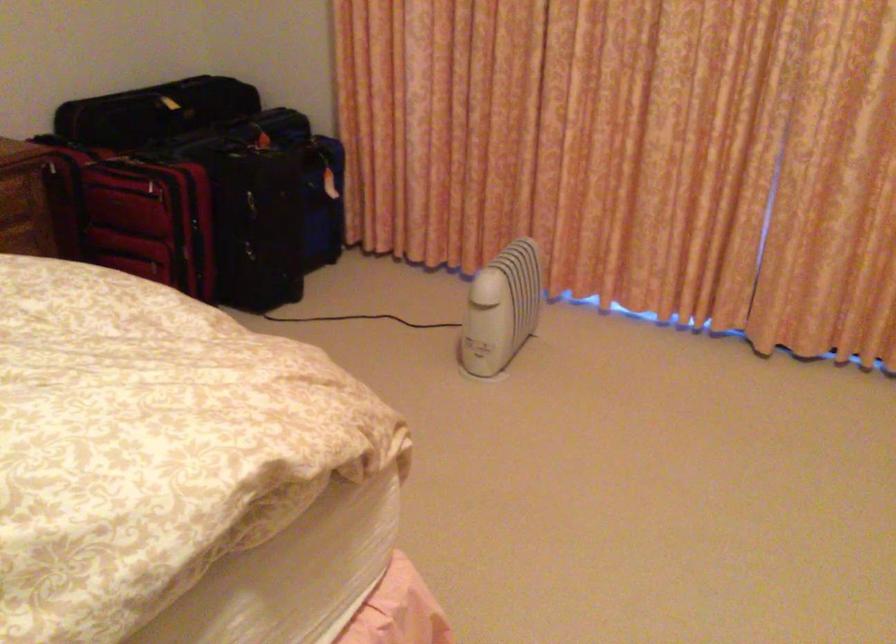
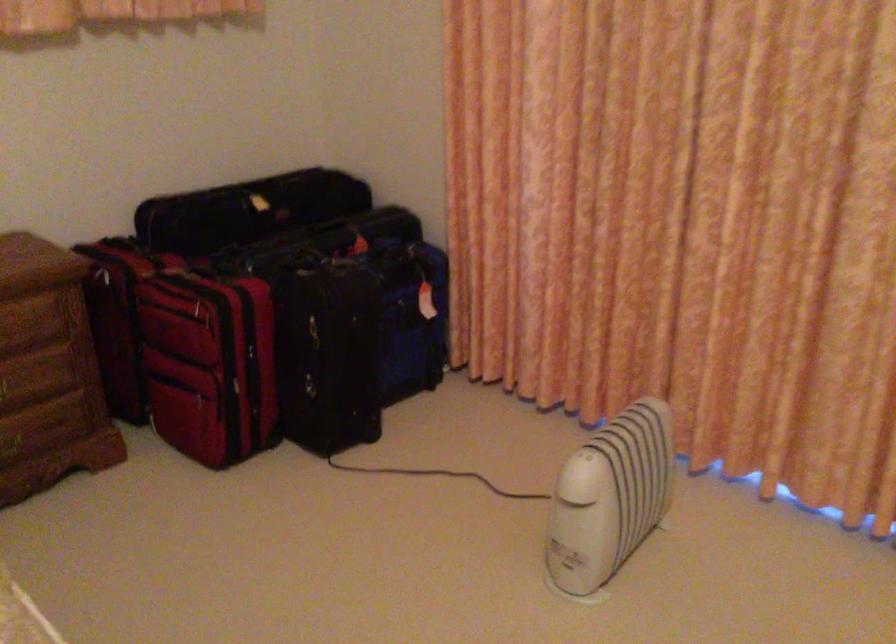
Where in the second image is the point corresponding to the point at 162,115 from the first image?

(247, 210)